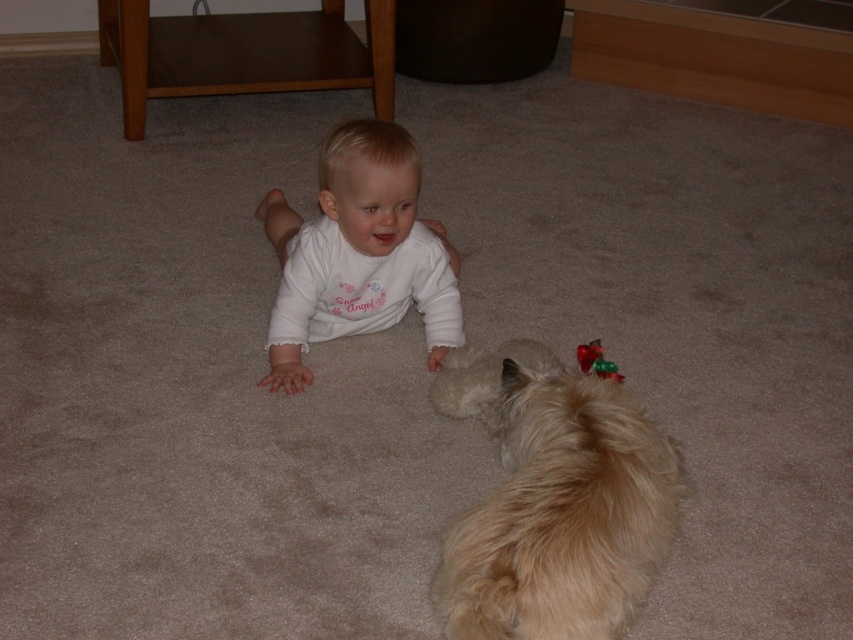
Question: Which object appears closest to the camera in this image?

Choices:
 (A) white soft baby at center
 (B) shiny red plastic toy at lower right

Answer: (B)

Question: Which of the following is the farthest from the observer?

Choices:
 (A) (612, 369)
 (B) (300, 280)

Answer: (B)

Question: Where is white soft baby at center located in relation to shiny red plastic toy at lower right in the image?

Choices:
 (A) above
 (B) below

Answer: (A)

Question: Can you confirm if white soft baby at center is positioned above shiny red plastic toy at lower right?

Choices:
 (A) yes
 (B) no

Answer: (A)

Question: Which of the following is the closest to the observer?

Choices:
 (A) (584, 582)
 (B) (593, 352)
 (C) (337, 332)

Answer: (A)

Question: Is fluffy golden fur dog at lower right closer to the viewer compared to shiny red plastic toy at lower right?

Choices:
 (A) yes
 (B) no

Answer: (A)